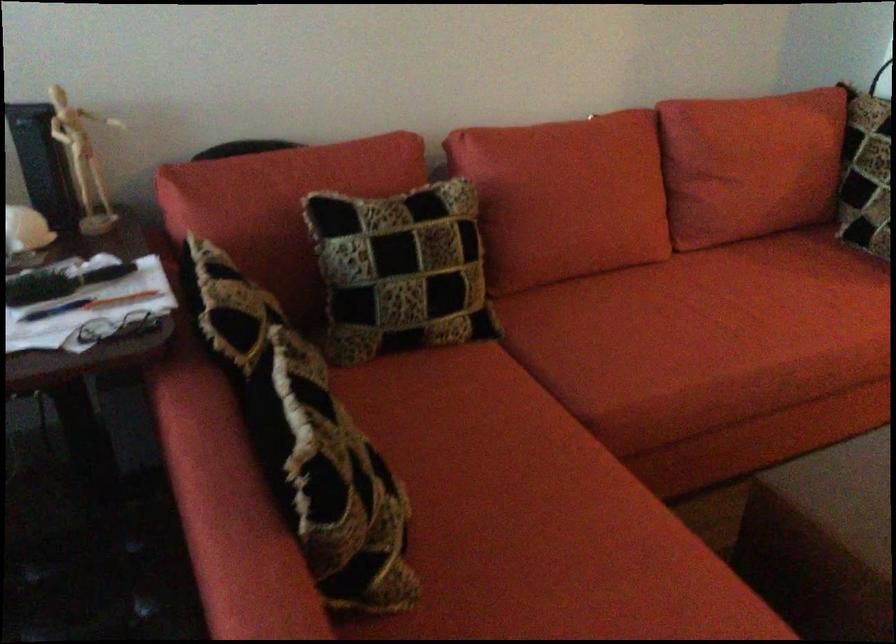
Where is `pair of eyeglasses`? This screenshot has height=644, width=896. pair of eyeglasses is located at coordinates (119, 328).